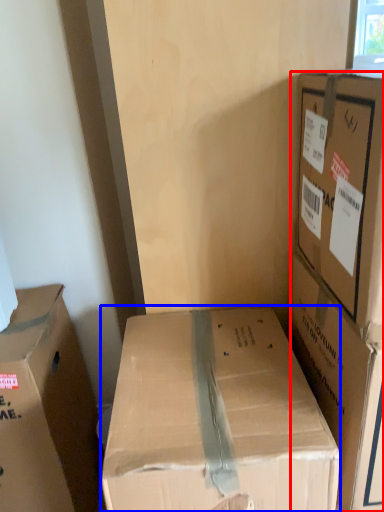
Question: Which of the following is the farthest to the observer, box (highlighted by a red box) or box (highlighted by a blue box)?

Choices:
 (A) box
 (B) box

Answer: (A)